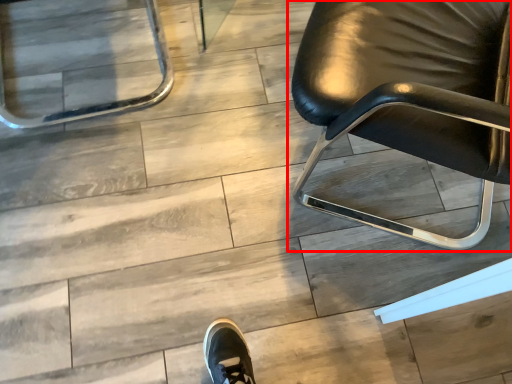
Question: From the image's perspective, considering the relative positions of chair (annotated by the red box) and chair in the image provided, where is chair (annotated by the red box) located with respect to the staircase?

Choices:
 (A) below
 (B) above

Answer: (A)